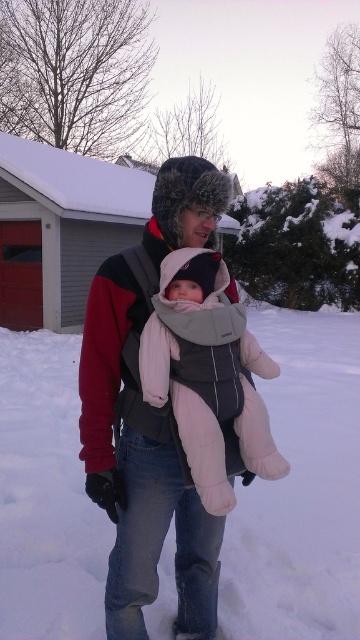
Question: Is gray fleece jacket at center closer to the viewer compared to light pink fleece baby carrier at center?

Choices:
 (A) yes
 (B) no

Answer: (B)

Question: Among these points, which one is farthest from the camera?

Choices:
 (A) (200, 524)
 (B) (187, 428)

Answer: (A)

Question: Can you confirm if gray fleece jacket at center is smaller than light pink fleece baby carrier at center?

Choices:
 (A) yes
 (B) no

Answer: (B)

Question: Which point is farther to the camera?

Choices:
 (A) (96, 348)
 (B) (150, 381)

Answer: (A)

Question: Is gray fleece jacket at center to the right of light pink fleece baby carrier at center from the viewer's perspective?

Choices:
 (A) yes
 (B) no

Answer: (B)